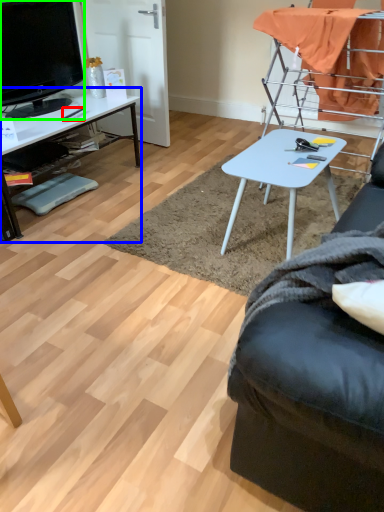
Question: Considering the real-world distances, which object is closest to pen (highlighted by a red box)? desk (highlighted by a blue box) or television (highlighted by a green box).

Choices:
 (A) desk
 (B) television

Answer: (A)